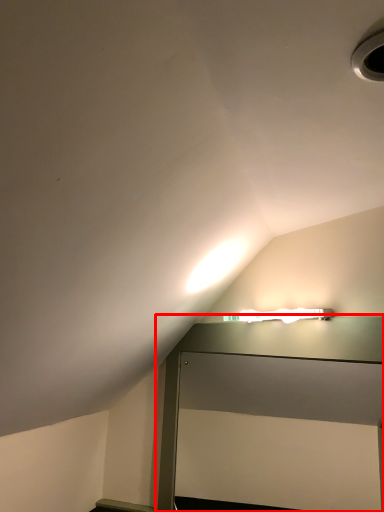
Question: Observing the image, what is the correct spatial positioning of table (annotated by the red box) in reference to hole?

Choices:
 (A) left
 (B) right

Answer: (A)